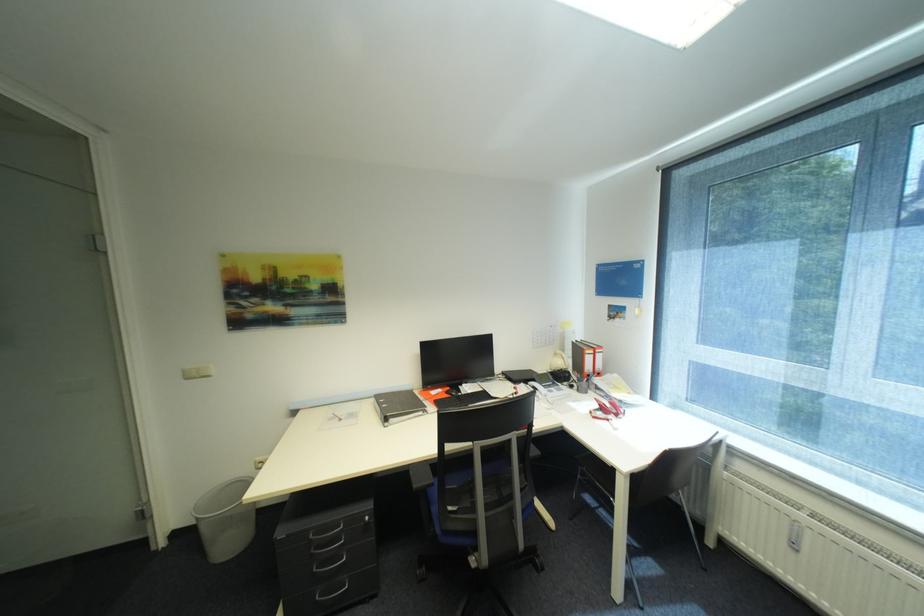
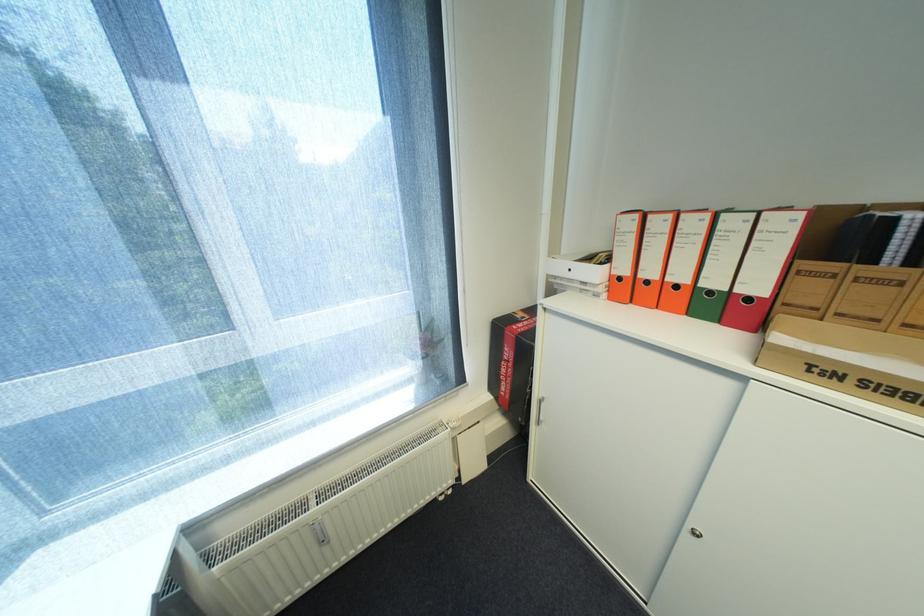
Where in the second image is the point corresponding to (x=798, y=540) from the first image?

(326, 541)